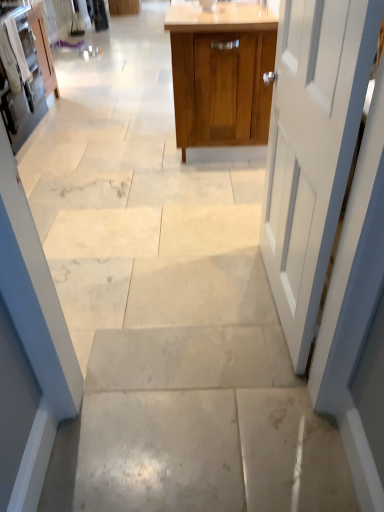
Find the location of a particular element. vacant space that is in between matte white cabinet at left, which is counted as the second cabinetry, starting from the right, and white painted wood door at right is located at coordinates (126, 207).